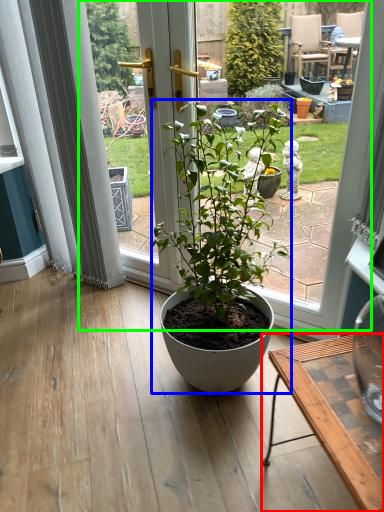
Question: Which object is the closest to the desk (highlighted by a red box)? Choose among these: houseplant (highlighted by a blue box) or bay window (highlighted by a green box).

Choices:
 (A) houseplant
 (B) bay window

Answer: (B)